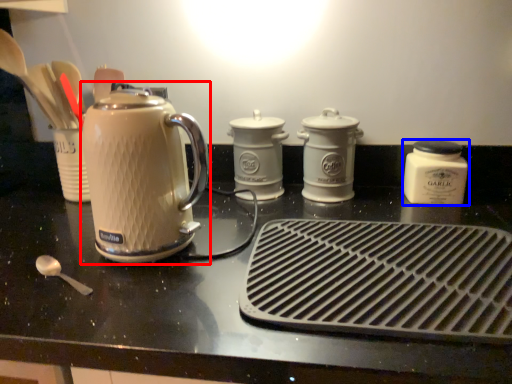
Question: Which object is further to the camera taking this photo, kettle (highlighted by a red box) or kitchen appliance (highlighted by a blue box)?

Choices:
 (A) kettle
 (B) kitchen appliance

Answer: (B)